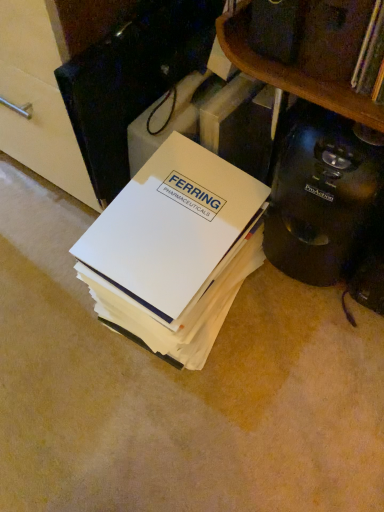
Question: Considering the positions of point (170, 267) and point (357, 208), is point (170, 267) closer or farther from the camera than point (357, 208)?

Choices:
 (A) farther
 (B) closer

Answer: (A)

Question: Considering the positions of white paper at center and black plastic coffee maker at lower right in the image, is white paper at center bigger or smaller than black plastic coffee maker at lower right?

Choices:
 (A) big
 (B) small

Answer: (A)

Question: Is white paper at center in front of or behind black plastic coffee maker at lower right in the image?

Choices:
 (A) behind
 (B) front

Answer: (A)

Question: In terms of width, does black plastic coffee maker at lower right look wider or thinner when compared to white paper at center?

Choices:
 (A) wide
 (B) thin

Answer: (B)

Question: Which is correct: black plastic coffee maker at lower right is inside white paper at center, or outside of it?

Choices:
 (A) outside
 (B) inside

Answer: (A)

Question: Based on their positions, is black plastic coffee maker at lower right located to the left or right of white paper at center?

Choices:
 (A) left
 (B) right

Answer: (B)

Question: From a real-world perspective, is black plastic coffee maker at lower right physically located above or below white paper at center?

Choices:
 (A) above
 (B) below

Answer: (A)